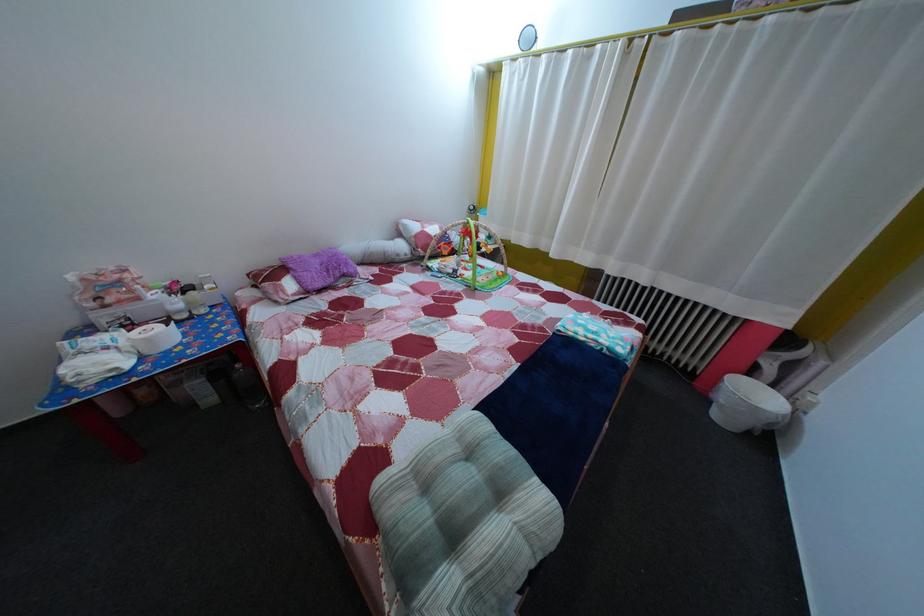
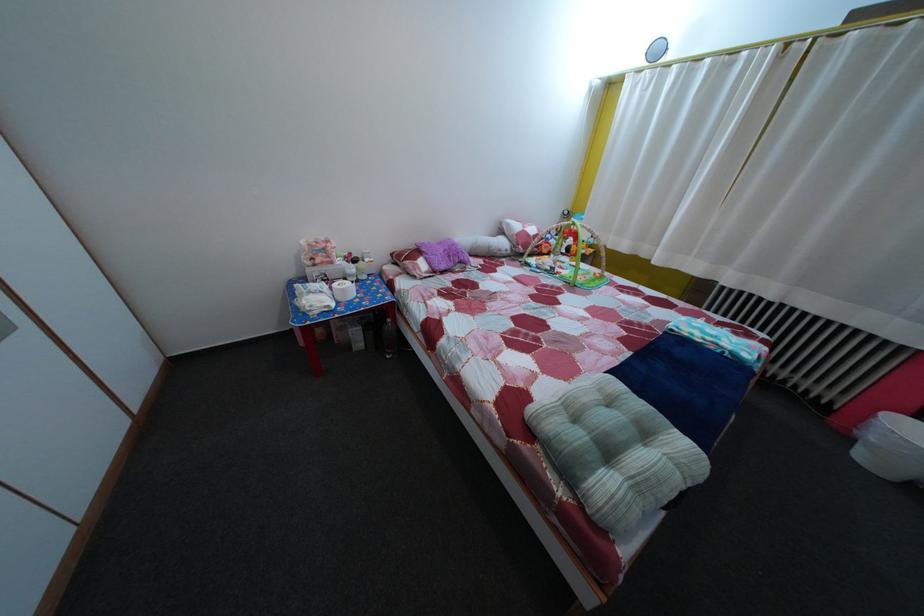
In the second image, find the point that corresponds to point (139, 328) in the first image.

(335, 284)